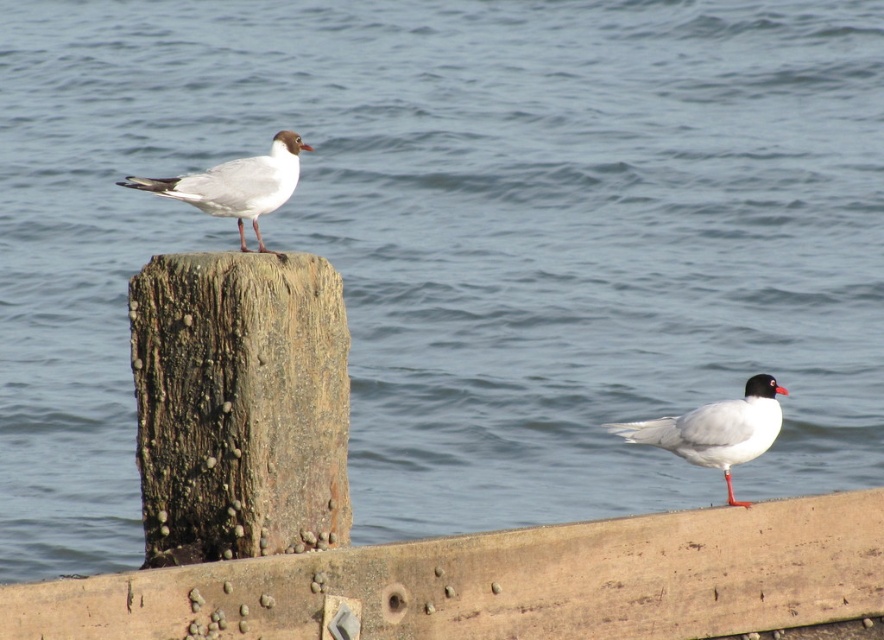
Question: Which point is farther to the camera?

Choices:
 (A) (730, 464)
 (B) (168, 428)
 (C) (526, 636)

Answer: (A)

Question: Does weathered wood dock at lower center have a larger size compared to white matte bird at lower right?

Choices:
 (A) yes
 (B) no

Answer: (A)

Question: Can you confirm if weathered wood dock at lower center is positioned to the left of white matte seagull at upper left?

Choices:
 (A) no
 (B) yes

Answer: (A)

Question: Considering the real-world distances, which object is closest to the white matte seagull at upper left?

Choices:
 (A) weathered wood dock at lower center
 (B) weathered wood post at center
 (C) white matte bird at lower right

Answer: (B)

Question: Based on their relative distances, which object is nearer to the weathered wood post at center?

Choices:
 (A) weathered wood dock at lower center
 (B) white matte bird at lower right
 (C) white matte seagull at upper left

Answer: (C)

Question: Where is weathered wood post at center located in relation to white matte bird at lower right in the image?

Choices:
 (A) left
 (B) right

Answer: (A)